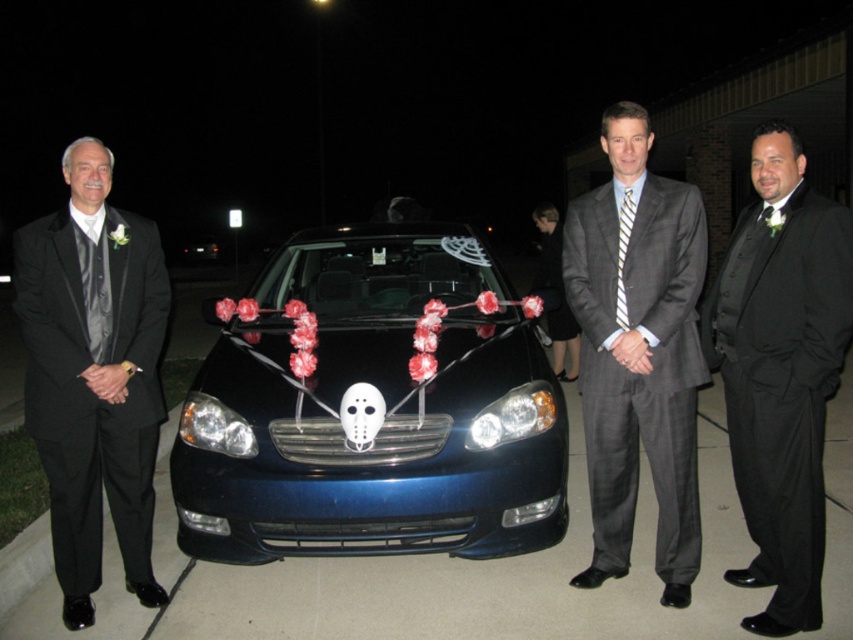
You are a photographer trying to capture a group photo of the black satin suit at center and the other men in the scene. The camera you are using has a maximum focus range of 10 feet. Will you be able to capture all the men in focus without moving the camera or the subjects?

The black satin suit at center and the other men are 10.58 feet apart. Since the camera can only focus within 10 feet, the distance exceeds the maximum range. Therefore, you cannot capture all the men in focus without adjusting the setup.

You are a photographer who needs to capture a photo of the metallic blue car at center and the black satin suit at center. Since the lighting is uneven, you want to ensure both subjects are well lit. Which subject should you adjust your camera focus to first to account for their positions?

The metallic blue car at center is located above the black satin suit at center, so you should focus on the metallic blue car at center first as it is higher up and may be in a different light zone.